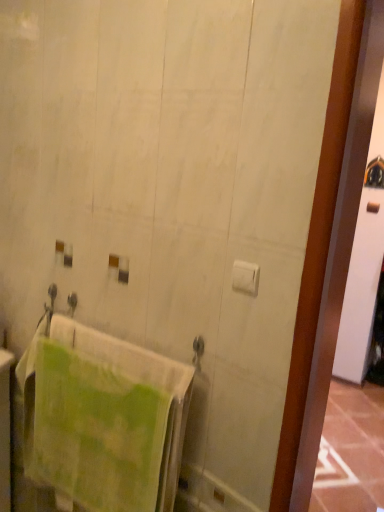
Question: Is green textured towel at lower left situated inside white matte toilet paper at center-right or outside?

Choices:
 (A) inside
 (B) outside

Answer: (B)

Question: Looking at their shapes, would you say green textured towel at lower left is wider or thinner than white matte toilet paper at center-right?

Choices:
 (A) thin
 (B) wide

Answer: (B)

Question: From the image's perspective, is green textured towel at lower left above or below white matte toilet paper at center-right?

Choices:
 (A) below
 (B) above

Answer: (A)

Question: From a real-world perspective, is white matte toilet paper at center-right physically located above or below green textured towel at lower left?

Choices:
 (A) above
 (B) below

Answer: (A)

Question: Is white matte toilet paper at center-right inside or outside of green textured towel at lower left?

Choices:
 (A) outside
 (B) inside

Answer: (A)

Question: Considering the relative positions of white matte toilet paper at center-right and green textured towel at lower left in the image provided, is white matte toilet paper at center-right to the left or to the right of green textured towel at lower left?

Choices:
 (A) right
 (B) left

Answer: (A)

Question: From the image's perspective, is white matte toilet paper at center-right above or below green textured towel at lower left?

Choices:
 (A) below
 (B) above

Answer: (B)